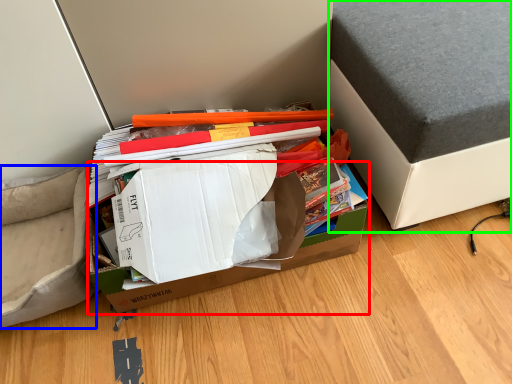
Question: Which is nearer to the cardboard box (highlighted by a red box)? armchair (highlighted by a blue box) or furniture (highlighted by a green box).

Choices:
 (A) armchair
 (B) furniture

Answer: (A)